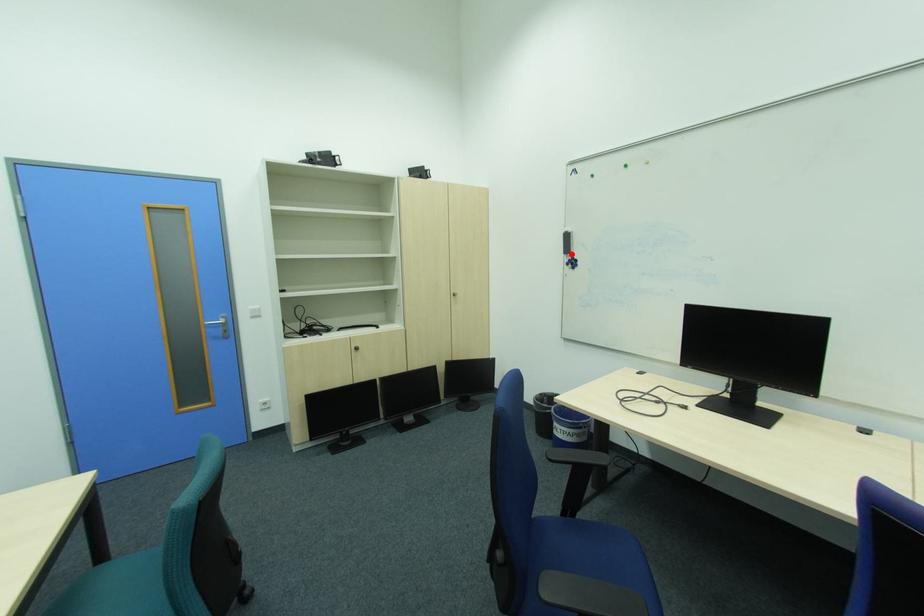
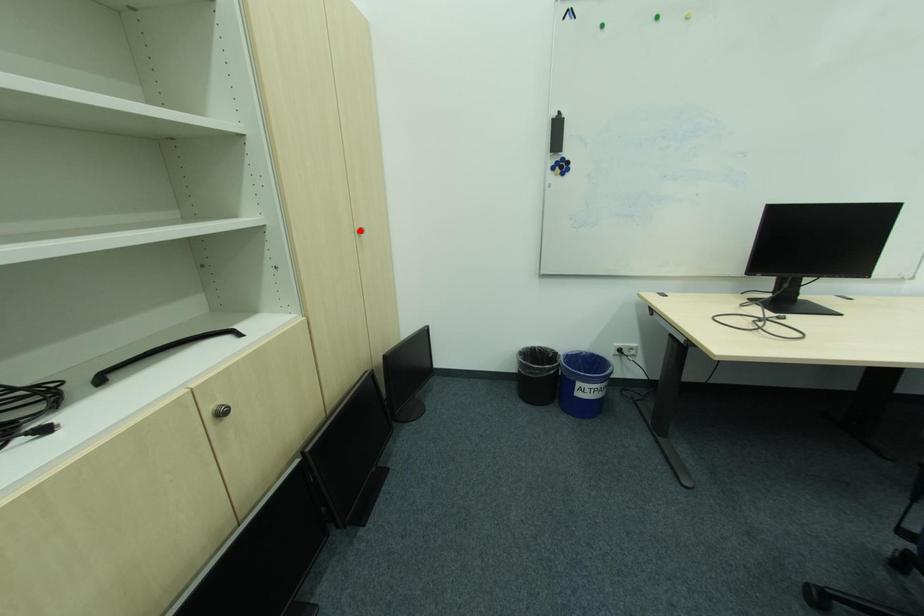
I am providing you with two images of the same scene from different viewpoints. A red point is marked on the first image and another point is marked on the second image. Is the marked point in image1 the same physical position as the marked point in image2?

No